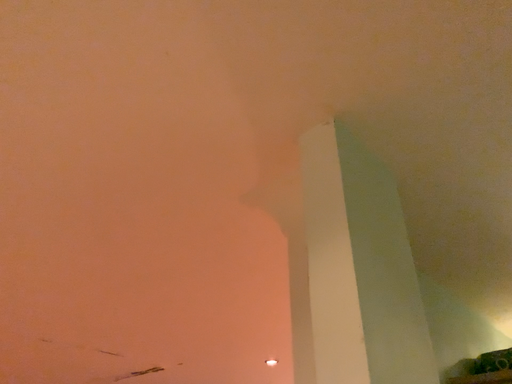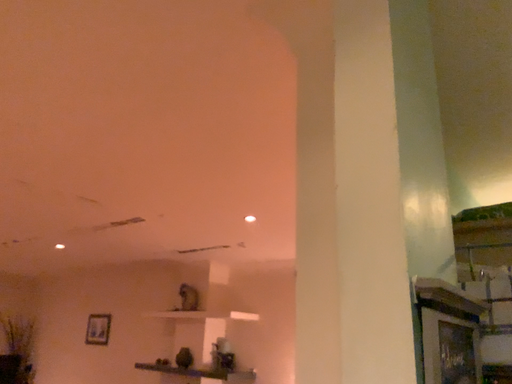
Question: How did the camera likely rotate when shooting the video?

Choices:
 (A) rotated upward
 (B) rotated downward

Answer: (B)